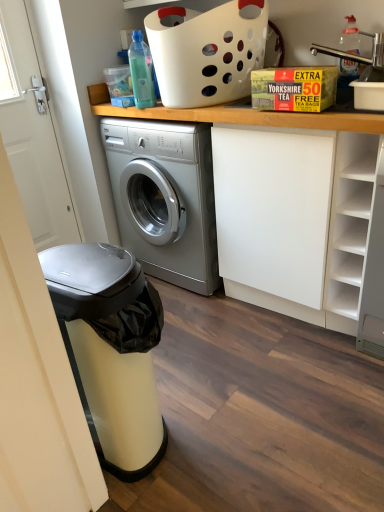
Image resolution: width=384 pixels, height=512 pixels. Describe the element at coordinates (141, 72) in the screenshot. I see `transparent plastic bottle at upper left, arranged as the 2th bottle when viewed from the right` at that location.

In order to face yellow cardboard box at upper center, should I rotate leftwards or rightwards?

Turn right approximately 13.600 degrees to face it.

The image size is (384, 512). I want to click on transparent plastic bottle at upper left, arranged as the 2th bottle when viewed from the right, so pyautogui.click(x=141, y=72).

Does metallic silver faucet at upper right have a larger size compared to transparent plastic bottle at upper left, arranged as the 2th bottle when viewed from the right?

Correct, metallic silver faucet at upper right is larger in size than transparent plastic bottle at upper left, arranged as the 2th bottle when viewed from the right.

Does metallic silver faucet at upper right lie in front of transparent plastic bottle at upper left, the 1th bottle from the left?

Yes, it is in front of transparent plastic bottle at upper left, the 1th bottle from the left.

From the picture: Is metallic silver faucet at upper right turned away from transparent plastic bottle at upper left, the 1th bottle from the left?

metallic silver faucet at upper right does not have its back to transparent plastic bottle at upper left, the 1th bottle from the left.

From a real-world perspective, is metallic silver faucet at upper right over transparent plastic bottle at upper left, arranged as the 2th bottle when viewed from the right?

Actually, metallic silver faucet at upper right is physically below transparent plastic bottle at upper left, arranged as the 2th bottle when viewed from the right, in the real world.

How different are the orientations of yellow cardboard box at upper center and metallic silver faucet at upper right in degrees?

They differ by 0.0963 degrees in their facing directions.

Between yellow cardboard box at upper center and metallic silver faucet at upper right, which one has smaller width?

Thinner between the two is metallic silver faucet at upper right.

Would you say yellow cardboard box at upper center is a long distance from metallic silver faucet at upper right?

Actually, yellow cardboard box at upper center and metallic silver faucet at upper right are a little close together.

Considering the positions of objects yellow cardboard box at upper center and metallic silver faucet at upper right in the image provided, who is behind, yellow cardboard box at upper center or metallic silver faucet at upper right?

metallic silver faucet at upper right is behind.

From a real-world perspective, is white plastic basket at upper center located beneath metallic silver faucet at upper right?

Actually, white plastic basket at upper center is physically above metallic silver faucet at upper right in the real world.

Considering the sizes of objects white plastic basket at upper center and metallic silver faucet at upper right in the image provided, who is taller, white plastic basket at upper center or metallic silver faucet at upper right?

Standing taller between the two is white plastic basket at upper center.

Which is more to the right, white plastic basket at upper center or metallic silver faucet at upper right?

Positioned to the right is metallic silver faucet at upper right.

From the image's perspective, between white plastic basket at upper center and metallic silver faucet at upper right, which one is located above?

white plastic basket at upper center appears higher in the image.

Identify the location of counter below the white plastic basket at upper center (from a real-world perspective). This screenshot has height=512, width=384. (240, 115).

From the image's perspective, is white plastic basket at upper center under yellow cardboard box at upper center?

Actually, white plastic basket at upper center appears above yellow cardboard box at upper center in the image.

In the image, is white plastic basket at upper center positioned in front of or behind yellow cardboard box at upper center?

white plastic basket at upper center is positioned farther from the viewer than yellow cardboard box at upper center.

Is point (96, 446) more distant than point (153, 115)?

No, it is in front of (153, 115).

Is metallic stainless steel dishwasher at left completely or partially outside of yellow cardboard box at upper center?

Yes.

Is metallic stainless steel dishwasher at left positioned before yellow cardboard box at upper center?

Yes, metallic stainless steel dishwasher at left is in front of yellow cardboard box at upper center.

Are metallic stainless steel dishwasher at left and yellow cardboard box at upper center far apart?

No.

Which of these two, white matte shelf at right or clear plastic bottle at upper right, acting as the first bottle starting from the right, stands shorter?

With less height is clear plastic bottle at upper right, acting as the first bottle starting from the right.

Is point (337, 327) less distant than point (359, 46)?

No, (337, 327) is further to viewer.

From the image's perspective, is white matte shelf at right positioned above or below clear plastic bottle at upper right, the 2th bottle from the left?

Clearly, from the image's perspective, white matte shelf at right is below clear plastic bottle at upper right, the 2th bottle from the left.

You are a GUI agent. You are given a task and a screenshot of the screen. Output one action in this format:
    pyautogui.click(x=<x>, y=<y>)
    Task: Click on the 2nd bottle above when counting from the white matte shelf at right (from the image's perspective)
    The image size is (384, 512).
    Given the screenshot: What is the action you would take?
    pyautogui.click(x=346, y=79)

Locate an element on the screen. sink below the white plastic basket at upper center (from the image's perspective) is located at coordinates (364, 73).

Is metallic silver faucet at upper right located outside white plastic basket at upper center?

That's correct, metallic silver faucet at upper right is outside of white plastic basket at upper center.

Is point (354, 100) closer to camera compared to point (153, 61)?

Yes, point (354, 100) is in front of point (153, 61).

Is metallic silver faucet at upper right in front of white plastic basket at upper center?

No, it is behind white plastic basket at upper center.

The image size is (384, 512). I want to click on sink in front of the transparent plastic bottle at upper left, the 1th bottle from the left, so click(364, 73).

Where is `sink above the yellow cardboard box at upper center (from the image's perspective)`? sink above the yellow cardboard box at upper center (from the image's perspective) is located at coordinates (364, 73).

Which object lies further to the anchor point transparent plastic bottle at upper left, the 1th bottle from the left, yellow cardboard box at upper center or white plastic basket at upper center?

yellow cardboard box at upper center is positioned further to the anchor transparent plastic bottle at upper left, the 1th bottle from the left.

Based on their spatial positions, is yellow cardboard box at upper center or metallic stainless steel dishwasher at left closer to white matte shelf at right?

yellow cardboard box at upper center is closer to white matte shelf at right.

Based on their spatial positions, is transparent plastic bottle at upper left, the 1th bottle from the left, or metallic stainless steel dishwasher at left further from white plastic basket at upper center?

metallic stainless steel dishwasher at left is positioned further to the anchor white plastic basket at upper center.

Considering their positions, is transparent plastic bottle at upper left, arranged as the 2th bottle when viewed from the right, positioned closer to yellow cardboard box at upper center than metallic silver faucet at upper right?

Based on the image, transparent plastic bottle at upper left, arranged as the 2th bottle when viewed from the right, appears to be nearer to yellow cardboard box at upper center.

From the picture: When comparing their distances from yellow cardboard box at upper center, does metallic stainless steel dishwasher at left or white matte shelf at right seem further?

Among the two, metallic stainless steel dishwasher at left is located further to yellow cardboard box at upper center.

When comparing their distances from white matte shelf at right, does metallic stainless steel dishwasher at left or clear plastic bottle at upper right, acting as the first bottle starting from the right, seem further?

metallic stainless steel dishwasher at left is further to white matte shelf at right.

Looking at the image, which one is located closer to transparent plastic bottle at upper left, the 1th bottle from the left, white plastic basket at upper center or yellow cardboard box at upper center?

white plastic basket at upper center.

Considering their positions, is yellow cardboard box at upper center positioned further to clear plastic bottle at upper right, acting as the first bottle starting from the right, than white matte shelf at right?

yellow cardboard box at upper center lies further to clear plastic bottle at upper right, acting as the first bottle starting from the right, than the other object.

Locate an element on the screen. This screenshot has width=384, height=512. shelf between transparent plastic bottle at upper left, the 1th bottle from the left, and metallic stainless steel dishwasher at left from top to bottom is located at coordinates (351, 226).

Where is `basket situated between transparent plastic bottle at upper left, arranged as the 2th bottle when viewed from the right, and clear plastic bottle at upper right, acting as the first bottle starting from the right, from left to right`? basket situated between transparent plastic bottle at upper left, arranged as the 2th bottle when viewed from the right, and clear plastic bottle at upper right, acting as the first bottle starting from the right, from left to right is located at coordinates (207, 51).

Where is `counter that lies between clear plastic bottle at upper right, the 2th bottle from the left, and white matte shelf at right from top to bottom`? The height and width of the screenshot is (512, 384). counter that lies between clear plastic bottle at upper right, the 2th bottle from the left, and white matte shelf at right from top to bottom is located at coordinates (240, 115).

You are a GUI agent. You are given a task and a screenshot of the screen. Output one action in this format:
    pyautogui.click(x=<x>, y=<y>)
    Task: Click on the sink between white plastic basket at upper center and white matte shelf at right vertically
    
    Given the screenshot: What is the action you would take?
    pyautogui.click(x=364, y=73)